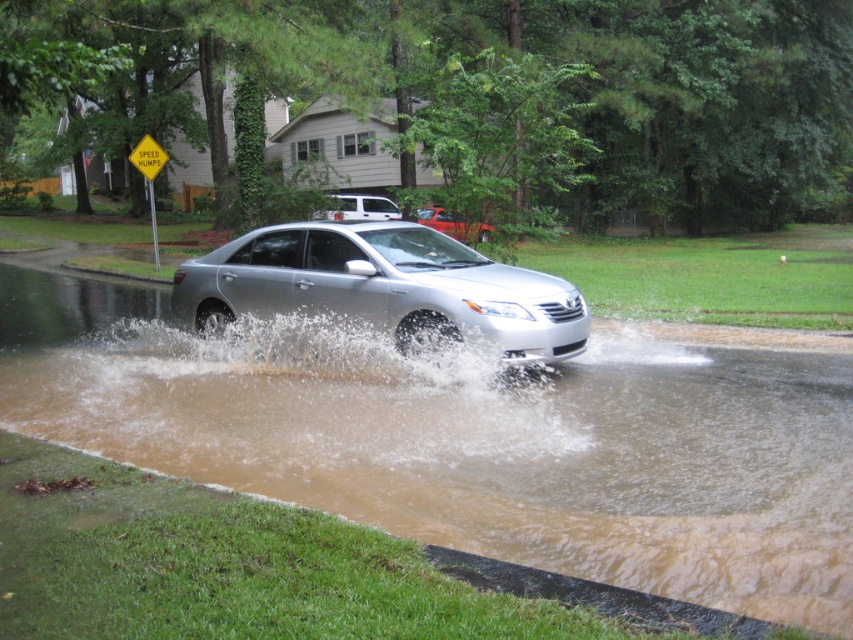
Question: Which point is closer to the camera taking this photo?

Choices:
 (A) (462, 218)
 (B) (409, 236)
 (C) (468, 353)
 (D) (357, 204)

Answer: (C)

Question: Estimate the real-world distances between objects in this image. Which object is farther from the silver metallic sedan at center?

Choices:
 (A) brown muddy water at center
 (B) matte silver sedan at center
 (C) white matte van at center

Answer: (C)

Question: Does brown muddy water at center have a larger size compared to matte silver sedan at center?

Choices:
 (A) yes
 (B) no

Answer: (A)

Question: Can you confirm if brown frothy water at center is positioned above white matte van at center?

Choices:
 (A) yes
 (B) no

Answer: (B)

Question: Which of the following is the closest to the observer?

Choices:
 (A) (444, 211)
 (B) (219, 280)
 (C) (373, 209)
 (D) (851, 628)

Answer: (D)

Question: Is brown frothy water at center above matte silver sedan at center?

Choices:
 (A) no
 (B) yes

Answer: (A)